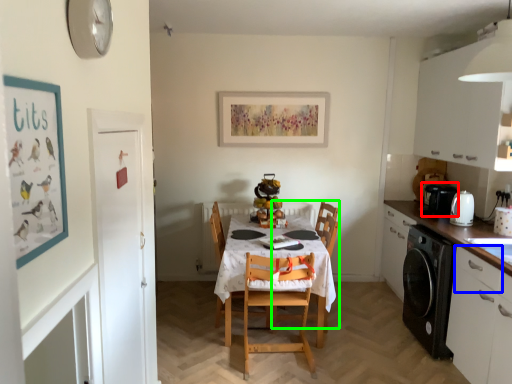
Question: Which is farther away from coffee machine (highlighted by a red box)? drawer (highlighted by a blue box) or armchair (highlighted by a green box)?

Choices:
 (A) drawer
 (B) armchair

Answer: (A)